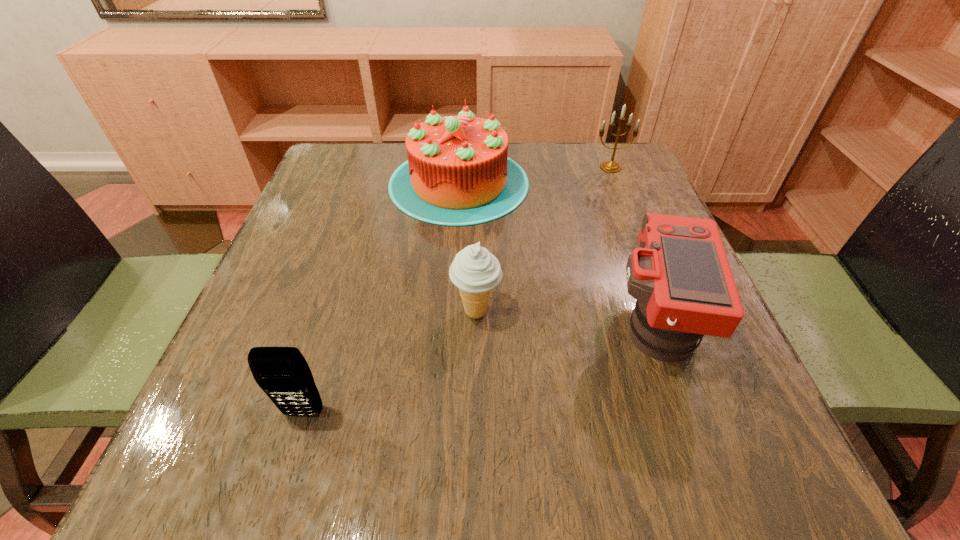
The width and height of the screenshot is (960, 540). Find the location of `cake`. cake is located at coordinates (458, 173).

Identify the location of candelabrum. The width and height of the screenshot is (960, 540). (608, 166).

The height and width of the screenshot is (540, 960). What are the coordinates of `camera` in the screenshot? It's located at (680, 276).

Locate an element on the screen. The height and width of the screenshot is (540, 960). icecream is located at coordinates (475, 271).

At what (x,y) coordinates should I click in order to perform the action: click on the leftmost object. Please return your answer as a coordinate pair (x, y). The image size is (960, 540). Looking at the image, I should click on (282, 373).

Find the location of a particular element. This screenshot has height=540, width=960. cellular telephone is located at coordinates 282,373.

This screenshot has height=540, width=960. Identify the location of vacant space situated 0.280m on the front of the cake. (450, 330).

This screenshot has height=540, width=960. What are the coordinates of `free space located on the left of the candelabrum` in the screenshot? It's located at (520, 167).

Where is `blank area located 0.260m on the back of the camera`? blank area located 0.260m on the back of the camera is located at coordinates (609, 197).

Find the location of a particular element. vacant region located 0.290m on the back of the icecream is located at coordinates (477, 200).